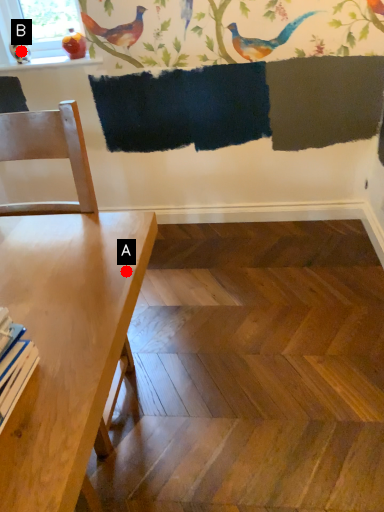
Question: Two points are circled on the image, labeled by A and B beside each circle. Which point is closer to the camera?

Choices:
 (A) A is closer
 (B) B is closer

Answer: (A)